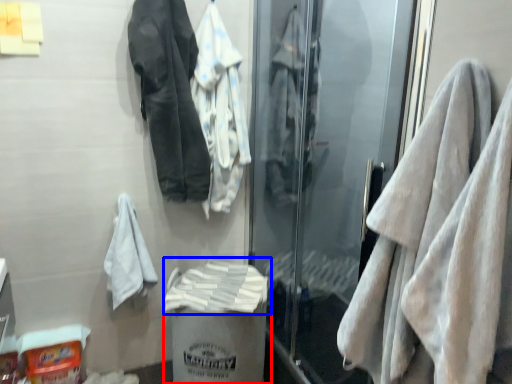
Question: Which object is further to the camera taking this photo, garbage (highlighted by a red box) or bath towel (highlighted by a blue box)?

Choices:
 (A) garbage
 (B) bath towel

Answer: (B)